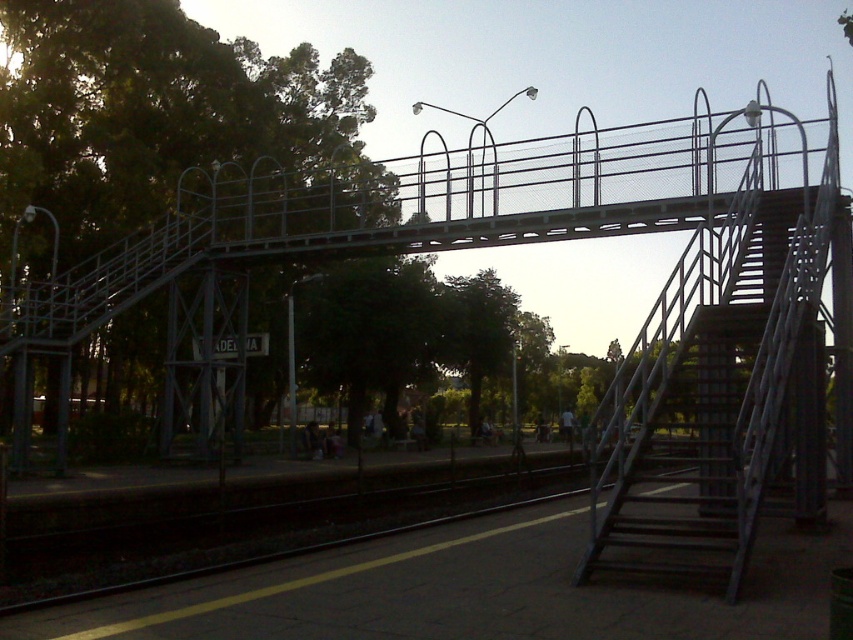
You are a maintenance worker needing to cross the metallic gray staircase at center to reach the other side of the railway tracks. However, there is a green leafy tree at center in the way. Can you pass through the space between them?

The metallic gray staircase at center might be wider than green leafy tree at center, so there might be enough space to pass between them. However, since the exact width difference isn not specified, it is uncertain whether the space is sufficient for safe passage.

You are a pedestrian standing on the platform at the train station. You see a point marked at coordinates (x=213, y=244). What object is located at that point?

The point at coordinates (x=213, y=244) marks a green leafy tree at upper center.

You are a pedestrian looking to cross the railway tracks safely. You notice a green leafy tree at upper center and a metallic gray staircase at center. Which object is larger in size?

The green leafy tree at upper center is bigger than the metallic gray staircase at center.